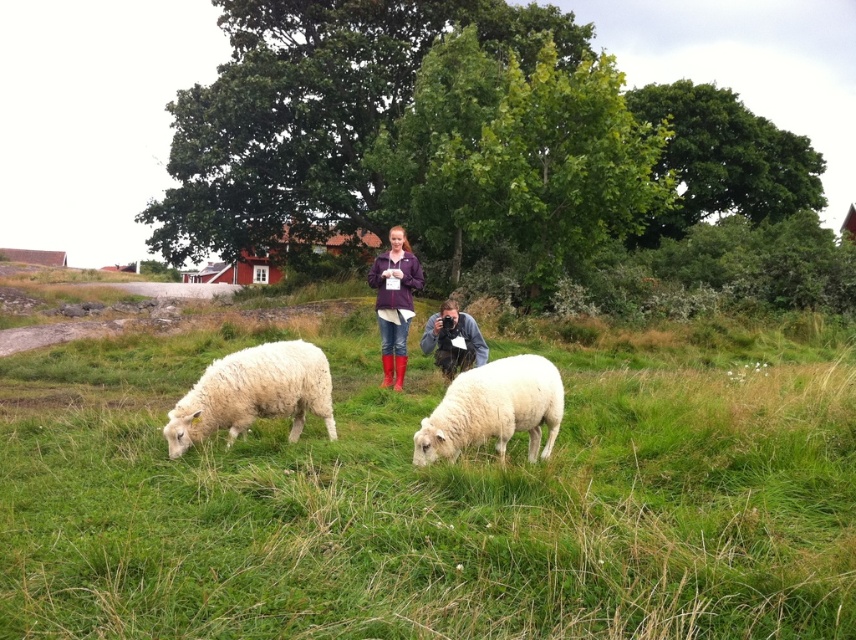
Question: Can you confirm if green soft grass at center is wider than purple fleece jacket at center?

Choices:
 (A) yes
 (B) no

Answer: (A)

Question: Is white woolly sheep at lower left below purple fleece jacket at center?

Choices:
 (A) yes
 (B) no

Answer: (A)

Question: Which is farther from the white woolly sheep at lower left?

Choices:
 (A) purple fleece jacket at center
 (B) white woolly sheep at center
 (C) green soft grass at center

Answer: (A)

Question: Which point is farther to the camera?

Choices:
 (A) white woolly sheep at lower left
 (B) green soft grass at center

Answer: (A)

Question: Does green soft grass at center have a smaller size compared to white woolly sheep at center?

Choices:
 (A) yes
 (B) no

Answer: (B)

Question: Which object appears farthest from the camera in this image?

Choices:
 (A) purple fleece jacket at center
 (B) white woolly sheep at lower left
 (C) white woolly sheep at center

Answer: (A)